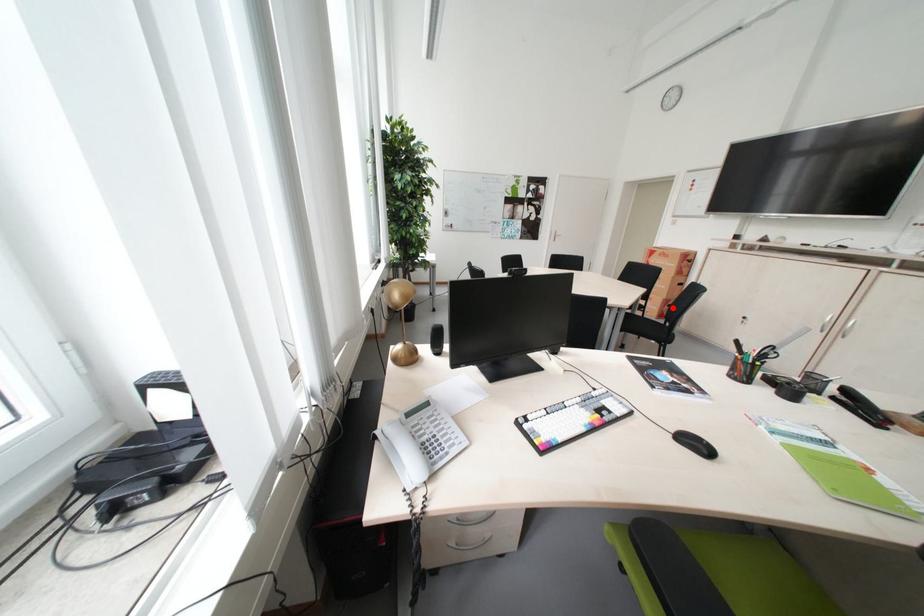
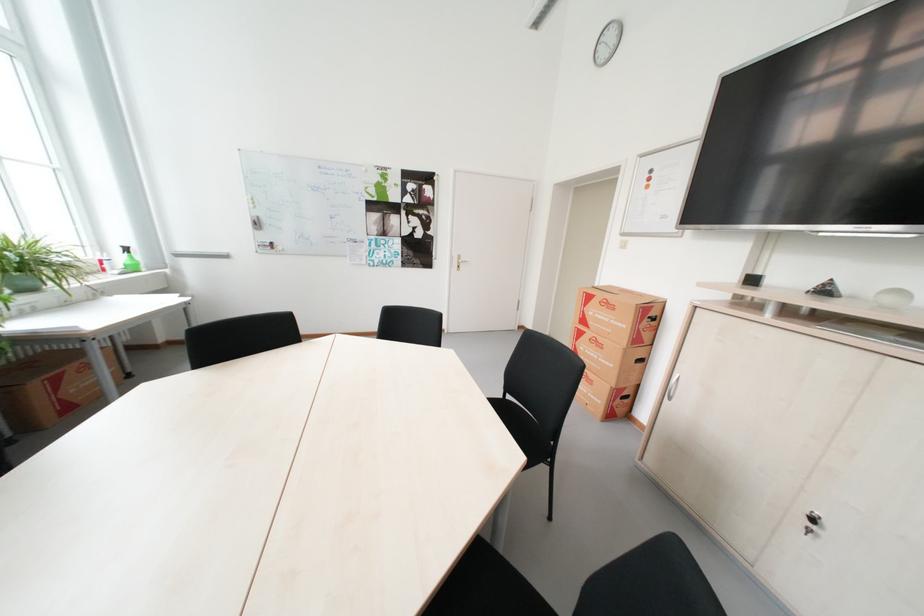
The point at the highlighted location is marked in the first image. Where is the corresponding point in the second image?

(622, 400)